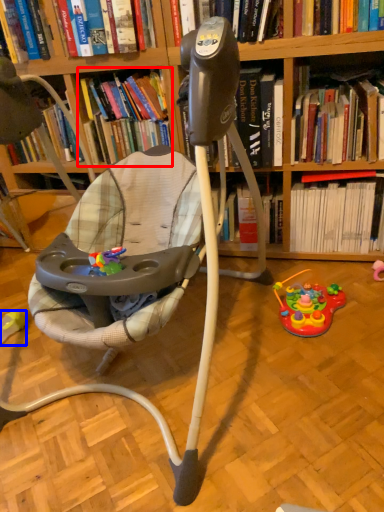
Question: Which point is closer to the camera, book (highlighted by a red box) or toy (highlighted by a blue box)?

Choices:
 (A) book
 (B) toy

Answer: (A)